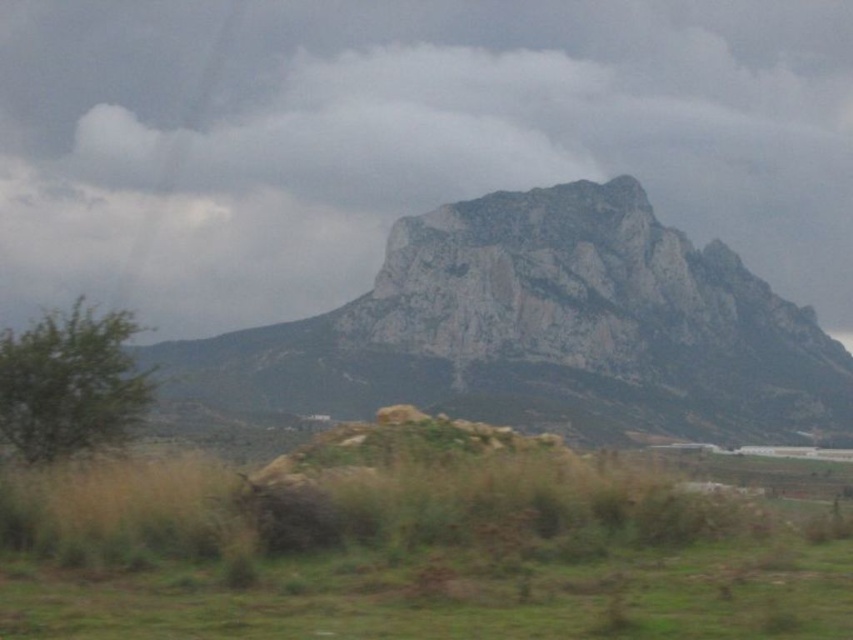
Question: Among these points, which one is nearest to the camera?

Choices:
 (A) (721, 225)
 (B) (300, 632)
 (C) (257, 360)

Answer: (B)

Question: Among these points, which one is nearest to the camera?

Choices:
 (A) (349, 301)
 (B) (668, 508)
 (C) (218, 168)

Answer: (B)

Question: Does green grass at lower center have a larger size compared to granite rock formation at center?

Choices:
 (A) no
 (B) yes

Answer: (A)

Question: Is white cloudy sky at upper center closer to camera compared to green grass at lower center?

Choices:
 (A) no
 (B) yes

Answer: (A)

Question: Which is nearer to the white cloudy sky at upper center?

Choices:
 (A) green grass at lower center
 (B) granite rock formation at center

Answer: (B)

Question: Does green grass at lower center appear on the left side of granite rock formation at center?

Choices:
 (A) no
 (B) yes

Answer: (A)